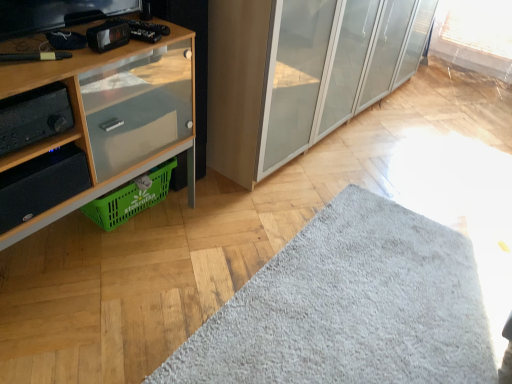
Where is `free spot in front of green plastic basket at lower left`? The image size is (512, 384). free spot in front of green plastic basket at lower left is located at coordinates (88, 268).